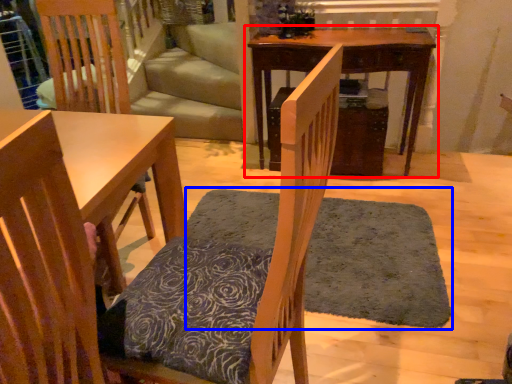
Question: Which object appears closest to the camera in this image, table (highlighted by a red box) or doormat (highlighted by a blue box)?

Choices:
 (A) table
 (B) doormat

Answer: (B)